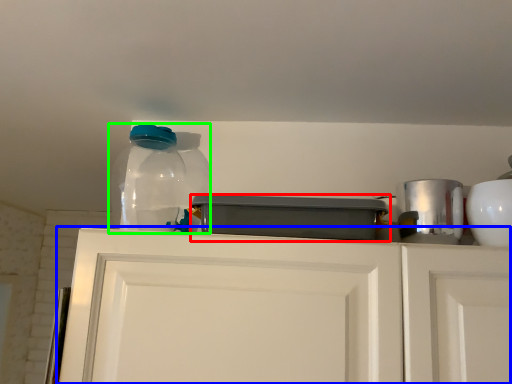
Question: Based on their relative distances, which object is nearer to appliance (highlighted by a red box)? Choose from cabinetry (highlighted by a blue box) and bottle (highlighted by a green box).

Choices:
 (A) cabinetry
 (B) bottle

Answer: (A)